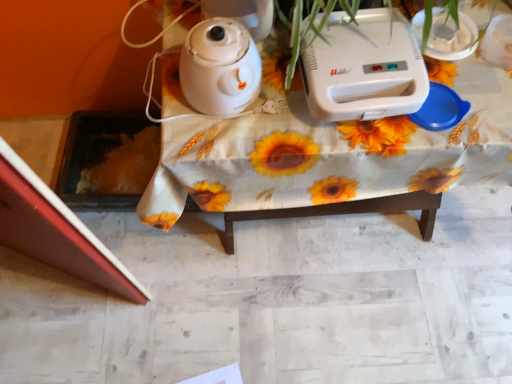
Find the location of a particular element. free space to the left of white plastic toaster at upper center is located at coordinates (269, 104).